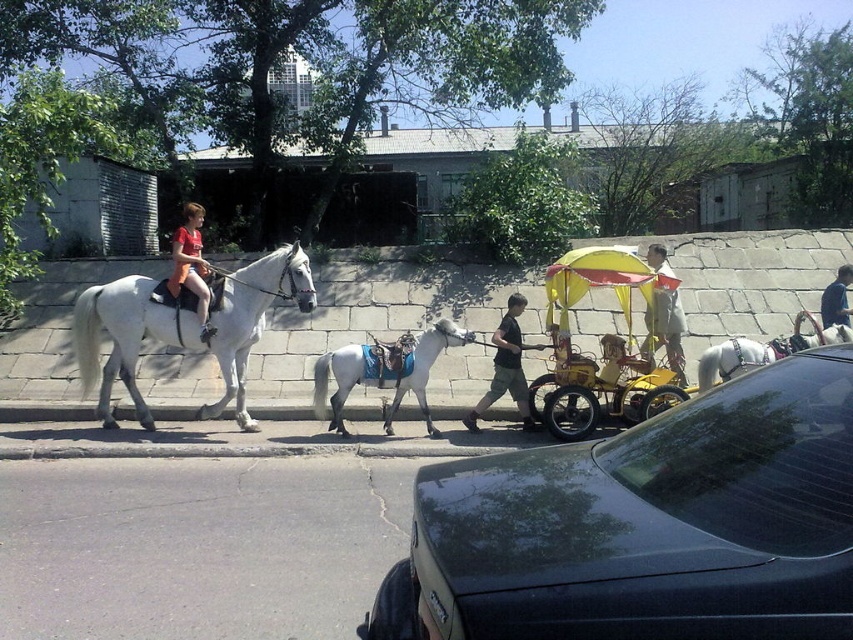
You are a pedestrian standing on the sidewalk and want to cross the street safely. There is a shiny black car at center and a light gray glossy horse at center in your path. Which one should you move away from first?

You should move away from the shiny black car at center first because it is closer to you than the light gray glossy horse at center, making it the immediate obstacle in your path.

You are a delivery person trying to decide whether to park your shiny black car at center in the parking spot next to the light gray glossy horse at center. Considering their heights, will the car fit under the low clearance sign that says maximum height 1.8 meters?

The shiny black car at center has a lesser height compared to light gray glossy horse at center. Since the horse is taller than the car, and the maximum height allowed is 1.8 meters, the car should fit under the low clearance sign as long as its height is under 1.8 meters. However, without knowing the exact height of the car, we cannot confirm for certain.